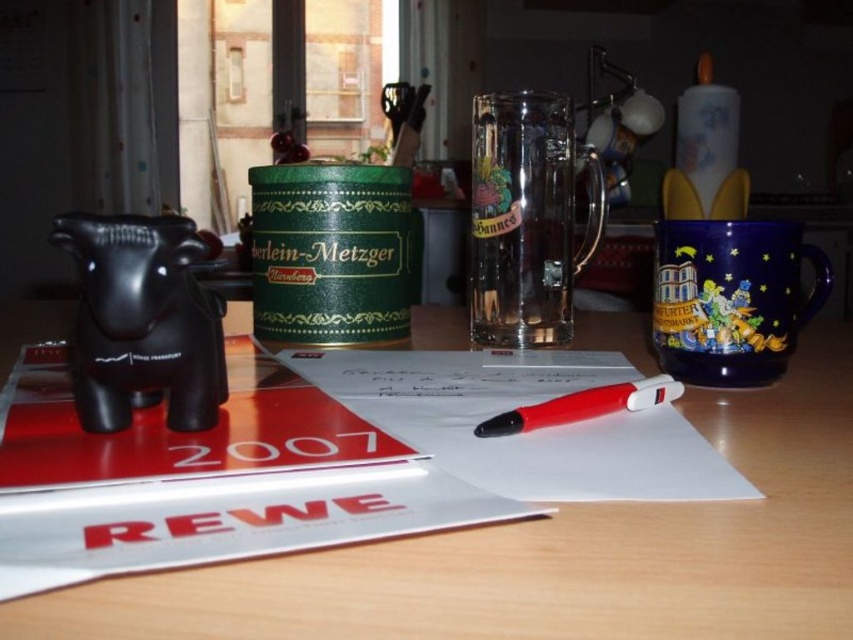
Is white paper at center wider than red plastic pen at center?

Yes, white paper at center is wider than red plastic pen at center.

This screenshot has width=853, height=640. I want to click on white paper at center, so click(x=524, y=433).

Is black rubber elephant at left above blue ceramic mug at right?

No.

What are the coordinates of `black rubber elephant at left` in the screenshot? It's located at (141, 321).

Between point (77, 321) and point (747, 378), which one is positioned behind?

Point (747, 378)

Locate an element on the screen. This screenshot has width=853, height=640. black rubber elephant at left is located at coordinates (141, 321).

Can you confirm if blue ceramic mug at right is wider than red plastic pen at center?

Yes.

Is point (693, 364) farther from viewer compared to point (682, 387)?

That is True.

Find the location of a particular element. This screenshot has width=853, height=640. blue ceramic mug at right is located at coordinates (730, 298).

Where is `blue ceramic mug at right`? Image resolution: width=853 pixels, height=640 pixels. blue ceramic mug at right is located at coordinates (730, 298).